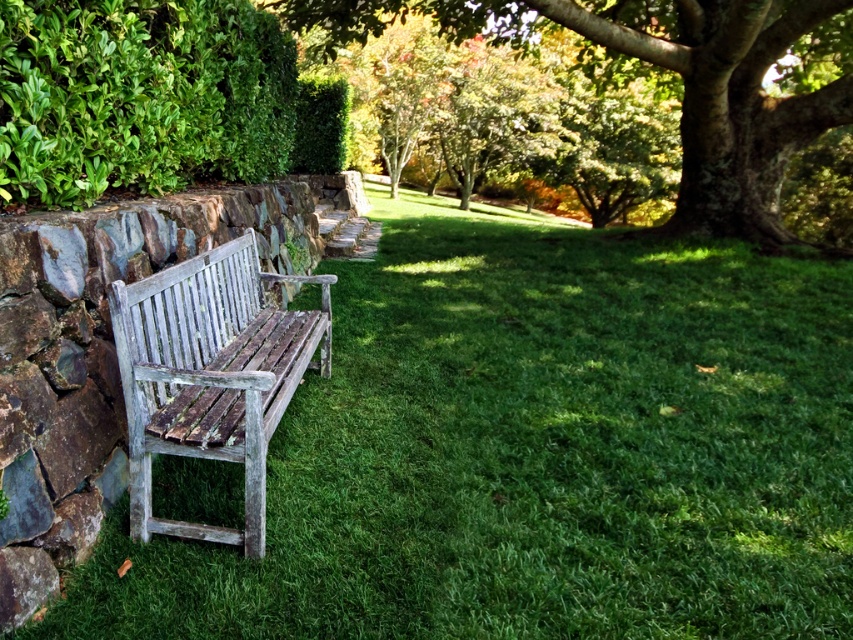
Question: Which object appears farthest from the camera in this image?

Choices:
 (A) green leafy tree at center
 (B) weathered wood bench at left

Answer: (A)

Question: Where is green leafy tree at center located in relation to weathered wood bench at left in the image?

Choices:
 (A) right
 (B) left

Answer: (A)

Question: Which of these objects is positioned farthest from the green leafy bush at upper left?

Choices:
 (A) weathered wood bench at left
 (B) green leafy tree at center

Answer: (B)

Question: Does green leafy bush at upper left have a lesser width compared to weathered wood bench at left?

Choices:
 (A) no
 (B) yes

Answer: (B)

Question: Is green leafy tree at center behind weathered wood bench at left?

Choices:
 (A) no
 (B) yes

Answer: (B)

Question: Which object appears farthest from the camera in this image?

Choices:
 (A) green leafy bush at upper left
 (B) green leafy tree at center

Answer: (B)